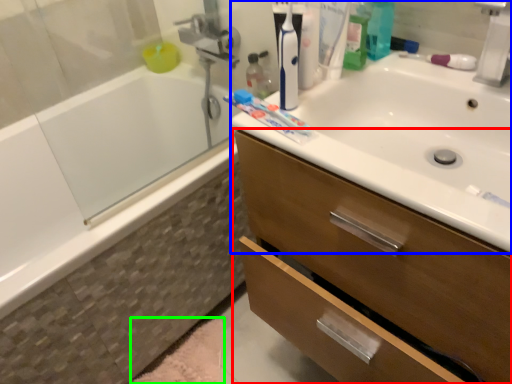
Question: Which object is positioned farthest from bathroom cabinet (highlighted by a red box)? Select from sink (highlighted by a blue box) and bath mat (highlighted by a green box).

Choices:
 (A) sink
 (B) bath mat

Answer: (B)